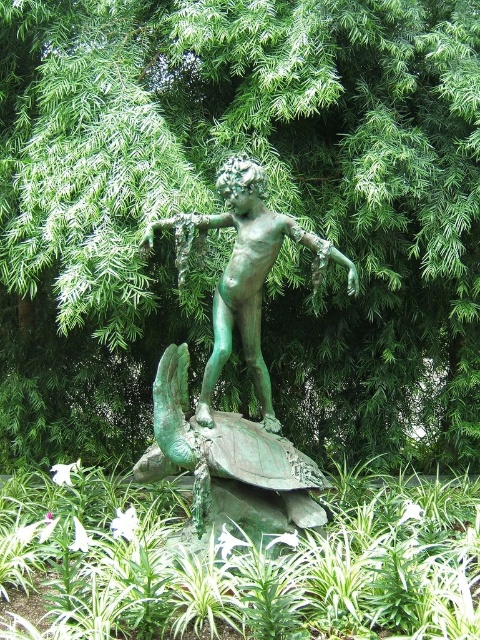
Question: Which is farther from the green textured statue at center?

Choices:
 (A) green patina tortoise at center
 (B) green patina turtle at center
 (C) green patina statue at center

Answer: (B)

Question: Which of the following is the closest to the observer?

Choices:
 (A) (439, 22)
 (B) (260, 344)
 (C) (164, 394)

Answer: (C)

Question: Is green patina turtle at center to the left of green patina tortoise at center from the viewer's perspective?

Choices:
 (A) no
 (B) yes

Answer: (A)

Question: Does green patina turtle at center lie in front of green patina statue at center?

Choices:
 (A) yes
 (B) no

Answer: (A)

Question: Is green patina turtle at center positioned before green patina tortoise at center?

Choices:
 (A) no
 (B) yes

Answer: (B)

Question: Estimate the real-world distances between objects in this image. Which object is closer to the green patina tortoise at center?

Choices:
 (A) green patina turtle at center
 (B) green textured statue at center

Answer: (A)